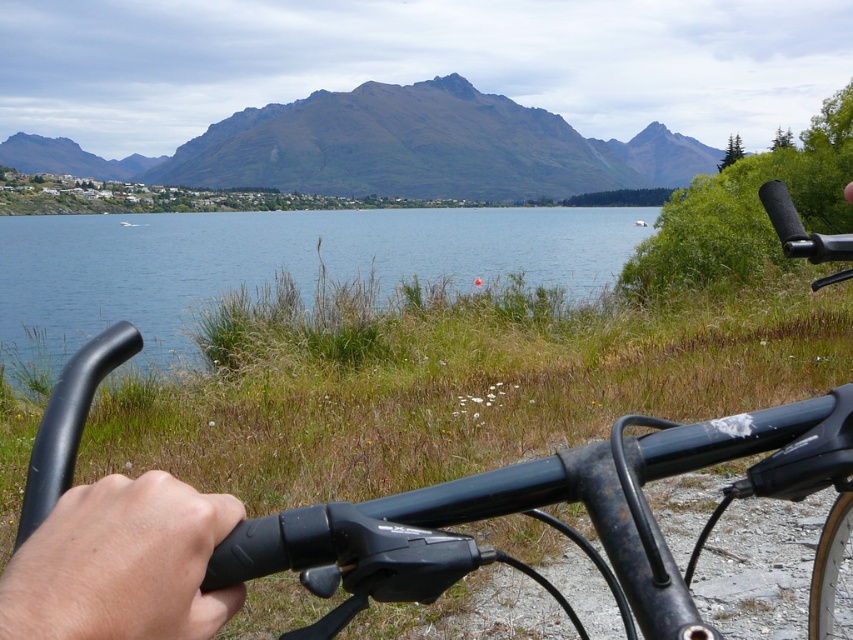
Which of these two, matte black bicycle handlebars at center or blue water at center, stands shorter?

Standing shorter between the two is matte black bicycle handlebars at center.

Can you confirm if matte black bicycle handlebars at center is shorter than blue water at center?

Yes, matte black bicycle handlebars at center is shorter than blue water at center.

The width and height of the screenshot is (853, 640). Describe the element at coordinates (543, 516) in the screenshot. I see `matte black bicycle handlebars at center` at that location.

The width and height of the screenshot is (853, 640). I want to click on matte black bicycle handlebars at center, so click(x=543, y=516).

Does blue water at center have a lesser height compared to brown rocky mountain at upper center?

Yes, blue water at center is shorter than brown rocky mountain at upper center.

Which is in front, point (215, 262) or point (309, 109)?

Positioned in front is point (215, 262).

Between point (392, 236) and point (439, 189), which one is positioned in front?

Point (392, 236) is in front.

At what (x,y) coordinates should I click in order to perform the action: click on blue water at center. Please return your answer as a coordinate pair (x, y). The width and height of the screenshot is (853, 640). Looking at the image, I should click on (276, 262).

Is matte black bicycle handlebars at center taller than brown rocky mountain at upper center?

No, matte black bicycle handlebars at center is not taller than brown rocky mountain at upper center.

Is point (399, 572) less distant than point (395, 136)?

That is True.

Where is `matte black bicycle handlebars at center`? The image size is (853, 640). matte black bicycle handlebars at center is located at coordinates (543, 516).